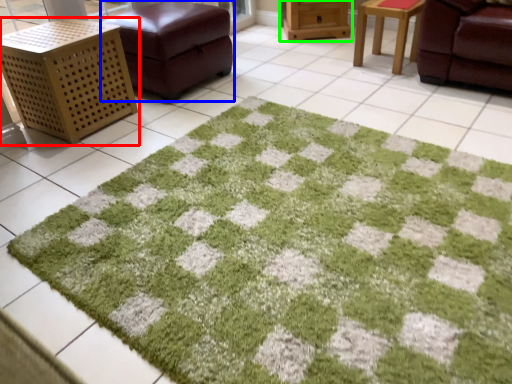
Question: Which object is positioned farthest from furniture (highlighted by a red box)? Select from furniture (highlighted by a blue box) and furniture (highlighted by a green box).

Choices:
 (A) furniture
 (B) furniture

Answer: (B)